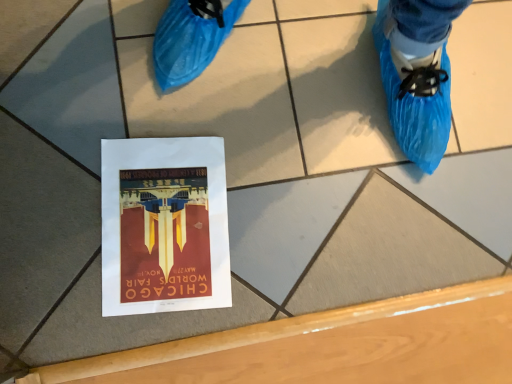
Locate an element on the screen. This screenshot has height=384, width=512. unoccupied space behind matte paper poster at center is located at coordinates (248, 127).